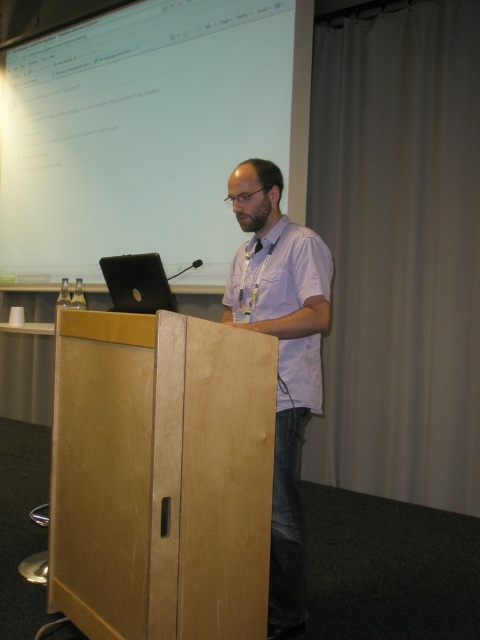
Question: Is white shirt at center positioned in front of white cotton shirt at center?

Choices:
 (A) yes
 (B) no

Answer: (A)

Question: Does white shirt at center have a smaller size compared to satin black laptop at center?

Choices:
 (A) yes
 (B) no

Answer: (B)

Question: Considering the real-world distances, which object is farthest from the white shirt at center?

Choices:
 (A) satin black laptop at center
 (B) white cotton shirt at center

Answer: (A)

Question: Which of the following is the farthest from the observer?

Choices:
 (A) white glossy projection screen at upper center
 (B) white shirt at center
 (C) white cotton shirt at center

Answer: (A)

Question: Can you confirm if white shirt at center is positioned to the left of satin black laptop at center?

Choices:
 (A) no
 (B) yes

Answer: (A)

Question: Which point is farther to the camera?

Choices:
 (A) satin black laptop at center
 (B) white cotton shirt at center
 (C) white glossy projection screen at upper center

Answer: (C)